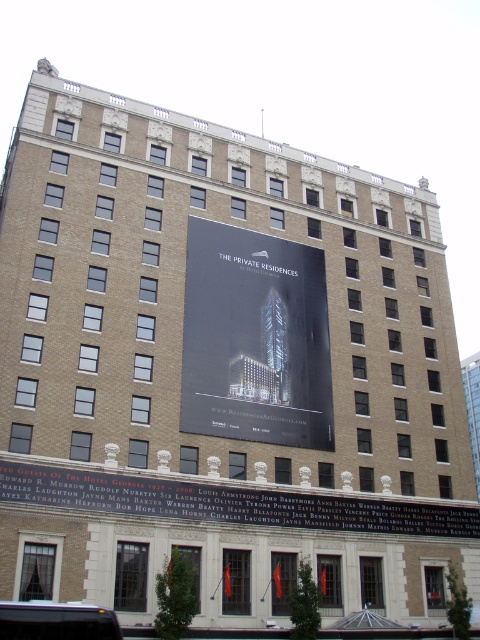
Question: Is black glossy poster at center to the left of black glossy sign at center from the viewer's perspective?

Choices:
 (A) no
 (B) yes

Answer: (B)

Question: In this image, where is black glossy poster at center located relative to black glossy sign at center?

Choices:
 (A) right
 (B) left

Answer: (B)

Question: Which point is farther to the camera?

Choices:
 (A) (193, 401)
 (B) (286, 522)

Answer: (A)

Question: Which of the following is the farthest from the observer?

Choices:
 (A) black glossy poster at center
 (B) black glossy sign at center

Answer: (A)

Question: Does black glossy poster at center appear on the right side of black glossy sign at center?

Choices:
 (A) no
 (B) yes

Answer: (A)